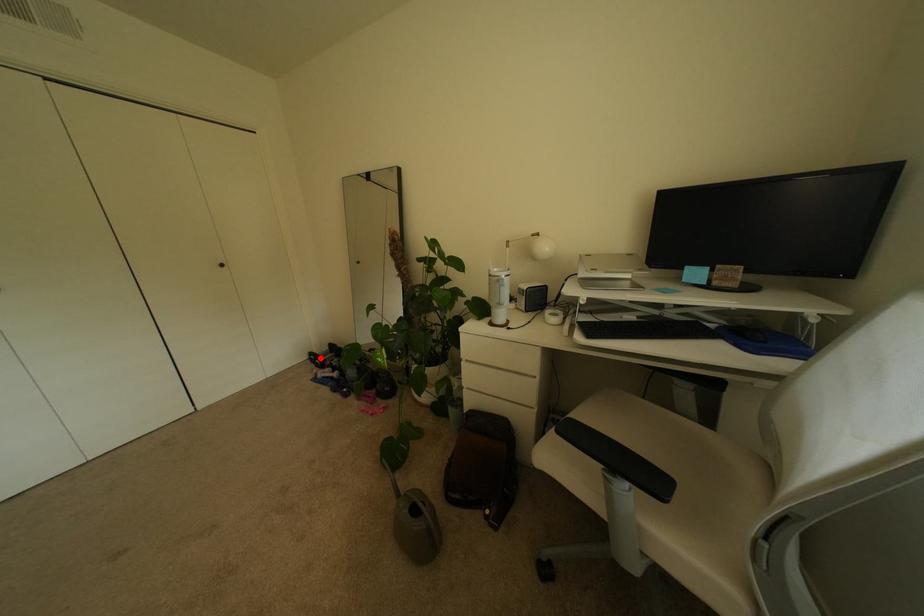
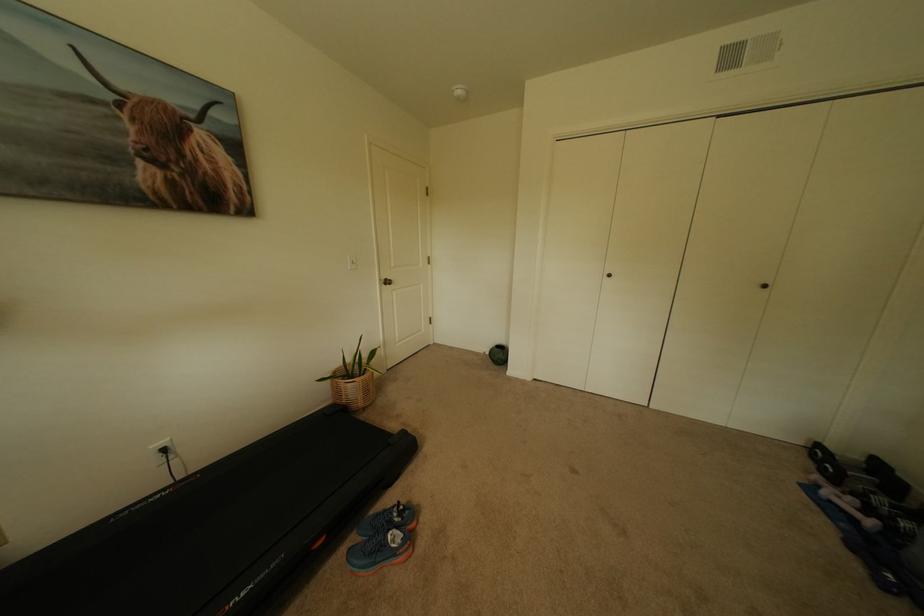
Question: I am providing you with two images of the same scene from different viewpoints. Given a red point in image1, look at the same physical point in image2. Is it:

Choices:
 (A) Closer to the viewpoint
 (B) Farther from the viewpoint

Answer: (A)